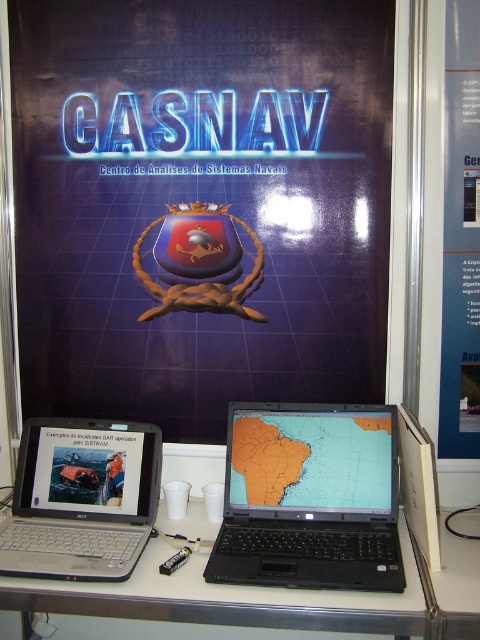
You are at the exhibition booth and want to take a photo of both the blue glossy poster at upper center and the orange matte map at center. Which object should you focus on first to ensure both are in the frame?

You should focus on the blue glossy poster at upper center first since it is closer to you than the orange matte map at center, ensuring both are in the frame.

You are an attendee at the exhibition and want to interact with the computer desk. The poster is blocking your view of the desk. Is the silver metallic computer desk at center in front of or behind the blue glossy poster at upper center?

The silver metallic computer desk at center is closer to the viewer than the blue glossy poster at upper center, so it is in front of the poster.